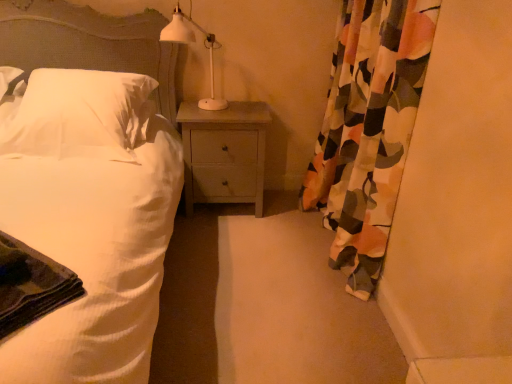
Question: Is floral fabric curtain at right oriented towards white matte table lamp at upper center?

Choices:
 (A) no
 (B) yes

Answer: (B)

Question: Considering the relative sizes of floral fabric curtain at right and white matte table lamp at upper center in the image provided, is floral fabric curtain at right taller than white matte table lamp at upper center?

Choices:
 (A) no
 (B) yes

Answer: (B)

Question: Would you say floral fabric curtain at right is a long distance from white matte table lamp at upper center?

Choices:
 (A) no
 (B) yes

Answer: (A)

Question: Can you confirm if floral fabric curtain at right is shorter than white matte table lamp at upper center?

Choices:
 (A) yes
 (B) no

Answer: (B)

Question: Considering the relative positions of floral fabric curtain at right and white matte table lamp at upper center in the image provided, is floral fabric curtain at right behind white matte table lamp at upper center?

Choices:
 (A) yes
 (B) no

Answer: (B)

Question: Can you see floral fabric curtain at right touching white matte table lamp at upper center?

Choices:
 (A) no
 (B) yes

Answer: (A)

Question: Can you confirm if white soft pillow at left is thinner than light wood nightstand at center?

Choices:
 (A) yes
 (B) no

Answer: (B)

Question: From the image's perspective, would you say white soft pillow at left is shown under light wood nightstand at center?

Choices:
 (A) no
 (B) yes

Answer: (A)

Question: Can you confirm if white soft pillow at left is taller than light wood nightstand at center?

Choices:
 (A) no
 (B) yes

Answer: (A)

Question: Considering the relative sizes of white soft pillow at left and light wood nightstand at center in the image provided, is white soft pillow at left shorter than light wood nightstand at center?

Choices:
 (A) yes
 (B) no

Answer: (A)

Question: Can you confirm if white soft pillow at left is bigger than light wood nightstand at center?

Choices:
 (A) yes
 (B) no

Answer: (A)

Question: From a real-world perspective, is white soft pillow at left positioned over light wood nightstand at center based on gravity?

Choices:
 (A) no
 (B) yes

Answer: (B)

Question: Is white matte table lamp at upper center next to white soft pillow at left and touching it?

Choices:
 (A) yes
 (B) no

Answer: (B)